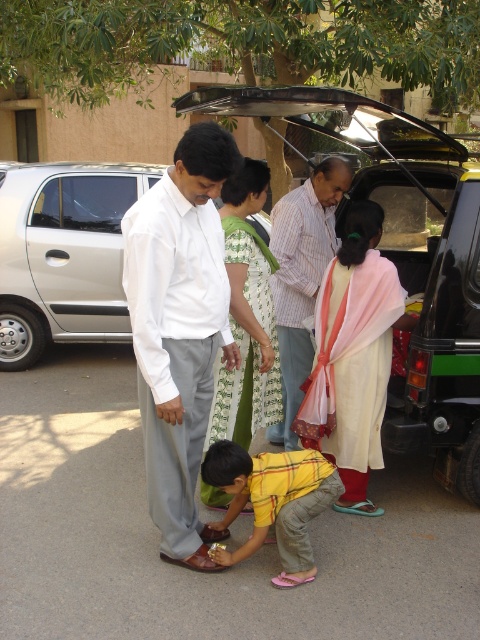
Question: Is silver metallic car at left to the right of white cotton saree at center from the viewer's perspective?

Choices:
 (A) yes
 (B) no

Answer: (B)

Question: Among these points, which one is farthest from the camera?

Choices:
 (A) (330, 486)
 (B) (363, 477)

Answer: (B)

Question: Among these points, which one is farthest from the camera?

Choices:
 (A) [x=144, y=250]
 (B) [x=381, y=214]
 (C) [x=216, y=401]

Answer: (B)

Question: Is white smooth shirt at center to the left of yellow plaid shirt at center from the viewer's perspective?

Choices:
 (A) no
 (B) yes

Answer: (B)

Question: Which point is farther from the camera taking this photo?

Choices:
 (A) (230, 285)
 (B) (168, 461)
 (C) (299, 502)

Answer: (A)

Question: Does silver metallic car at left have a smaller size compared to striped cotton shirt at center?

Choices:
 (A) yes
 (B) no

Answer: (B)